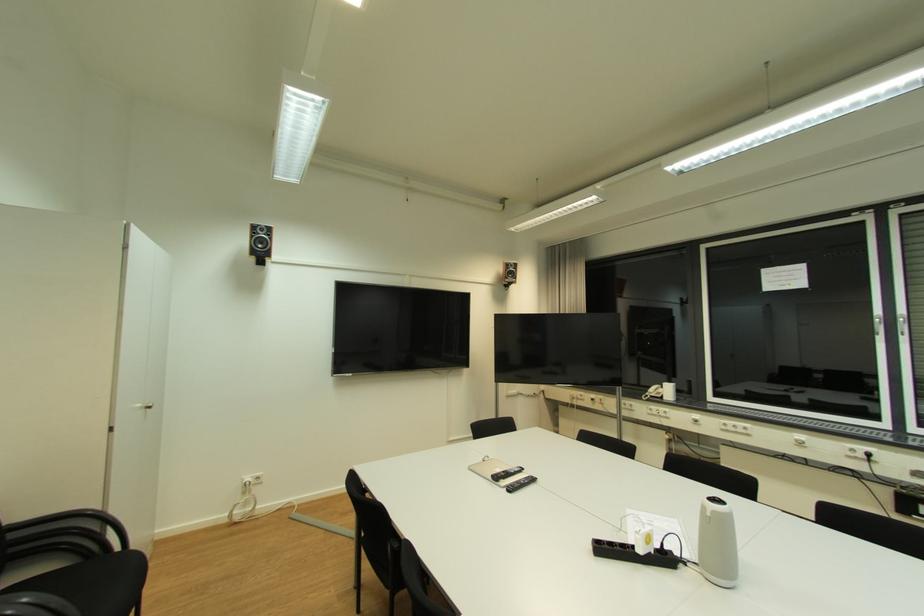
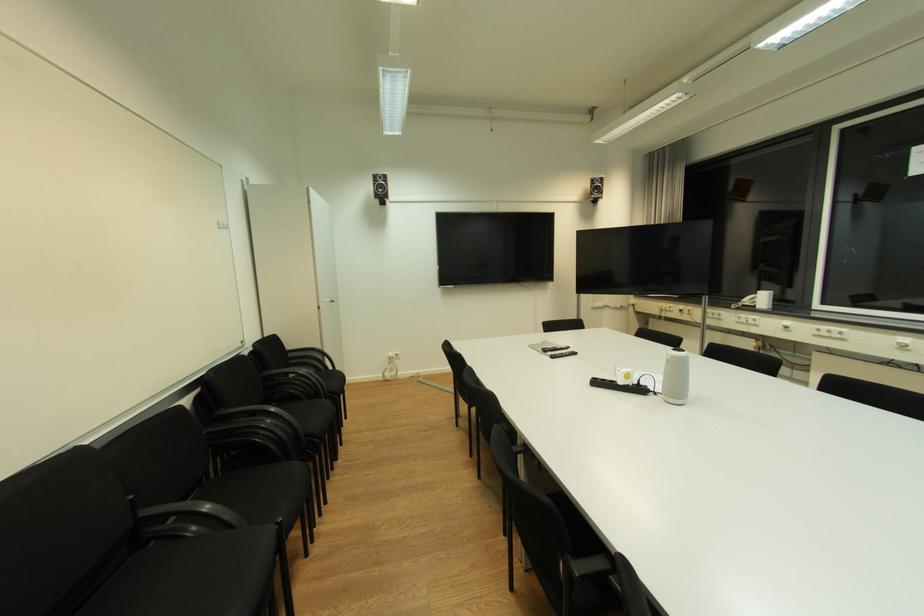
The point at (513, 476) is marked in the first image. Where is the corresponding point in the second image?

(561, 350)